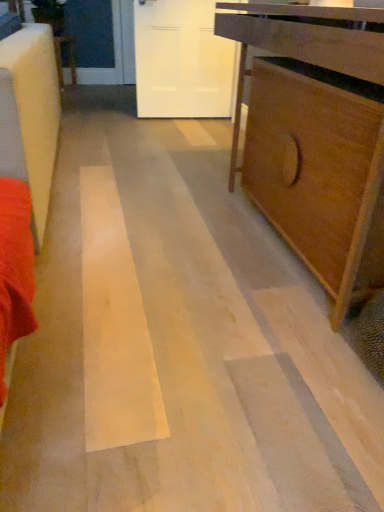
Question: Do you think wooden table at center is within white matte door at upper center, or outside of it?

Choices:
 (A) inside
 (B) outside

Answer: (B)

Question: From their relative heights in the image, would you say wooden table at center is taller or shorter than white matte door at upper center?

Choices:
 (A) tall
 (B) short

Answer: (B)

Question: Based on their relative distances, which object is farther from the matte brown cabinet at right?

Choices:
 (A) white matte door at upper center
 (B) wooden table at center

Answer: (B)

Question: Estimate the real-world distances between objects in this image. Which object is farther from the wooden table at center?

Choices:
 (A) matte brown cabinet at right
 (B) white matte door at upper center

Answer: (A)